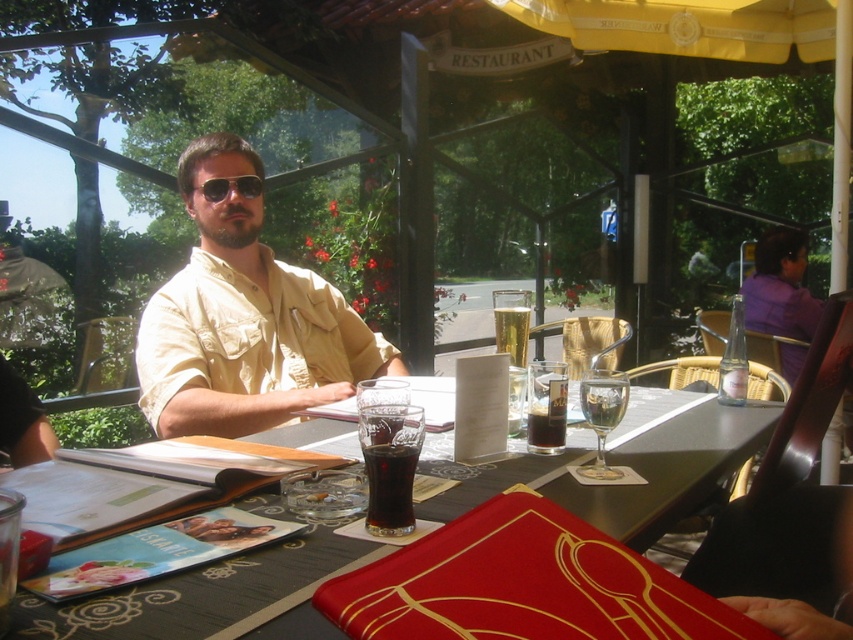
Consider the image. You are a photographer trying to capture the man in the beige cotton shirt at center. The camera you are using has a focus point at coordinate point (244,321). Will this focus point help you capture the man in the beige cotton shirt at center?

Yes, the focus point at coordinate point (244,321) marks the location of the man in the beige cotton shirt at center, so it will help you capture him.

You are a photographer taking a photo of the matte glass table at center and the clear glass wine glass at table center. Which object will appear larger in your photo?

The matte glass table at center will appear larger in the photo because it is closer to the viewer than the clear glass wine glass at table center.